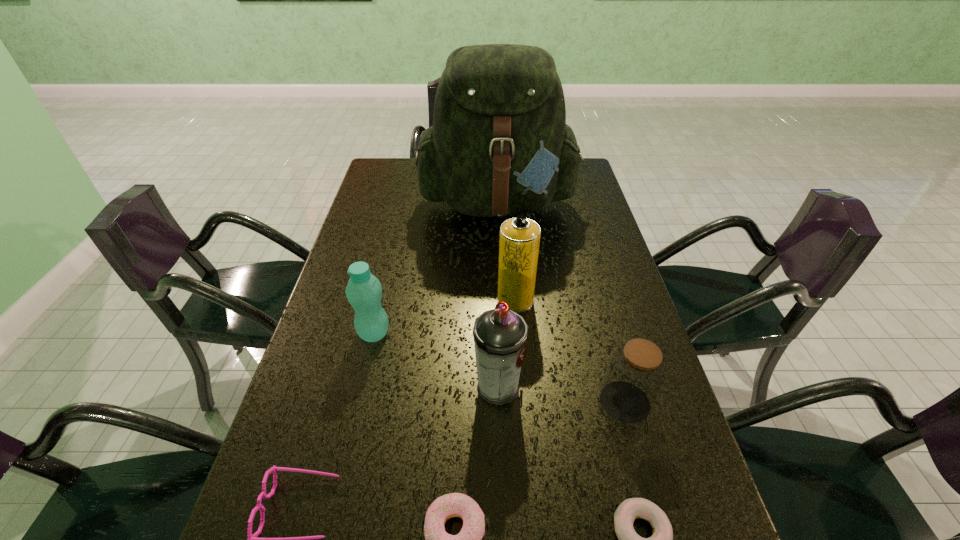
What are the coordinates of `free point located 0.270m on the right of the fourth tallest object` in the screenshot? It's located at (498, 334).

Where is `vacant area situated 0.170m on the front of the fifth tallest object`? This screenshot has height=540, width=960. vacant area situated 0.170m on the front of the fifth tallest object is located at coordinates (655, 511).

The height and width of the screenshot is (540, 960). I want to click on object that is at the far edge, so click(x=499, y=145).

This screenshot has width=960, height=540. What are the coordinates of `object present at the left edge` in the screenshot? It's located at (363, 291).

I want to click on backpack situated at the right edge, so click(499, 145).

Find the location of a particular element. The height and width of the screenshot is (540, 960). jar located at the right edge is located at coordinates 635,375.

Identify the location of object that is at the far right corner. (499, 145).

In the image, there is a desktop. What are the coordinates of `vacant space at the left edge` in the screenshot? It's located at (285, 437).

Identify the location of free location at the right edge. The height and width of the screenshot is (540, 960). (624, 312).

The height and width of the screenshot is (540, 960). I want to click on vacant space at the far left corner of the desktop, so click(400, 184).